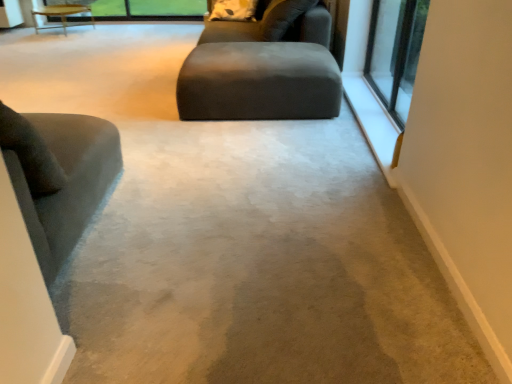
Question: From a real-world perspective, is matte gray ottoman at center over wooden table at upper left?

Choices:
 (A) no
 (B) yes

Answer: (B)

Question: Does matte gray ottoman at center come behind wooden table at upper left?

Choices:
 (A) yes
 (B) no

Answer: (B)

Question: Is matte gray ottoman at center beside wooden table at upper left?

Choices:
 (A) yes
 (B) no

Answer: (B)

Question: Considering the relative sizes of matte gray ottoman at center and wooden table at upper left in the image provided, is matte gray ottoman at center wider than wooden table at upper left?

Choices:
 (A) yes
 (B) no

Answer: (A)

Question: Are matte gray ottoman at center and wooden table at upper left located far from each other?

Choices:
 (A) no
 (B) yes

Answer: (B)

Question: Is velvet gray chair at left wider or thinner than matte gray ottoman at center?

Choices:
 (A) wide
 (B) thin

Answer: (B)

Question: Is velvet gray chair at left bigger or smaller than matte gray ottoman at center?

Choices:
 (A) big
 (B) small

Answer: (A)

Question: Is velvet gray chair at left taller or shorter than matte gray ottoman at center?

Choices:
 (A) tall
 (B) short

Answer: (A)

Question: From a real-world perspective, relative to matte gray ottoman at center, is velvet gray chair at left vertically above or below?

Choices:
 (A) above
 (B) below

Answer: (A)

Question: From the image's perspective, relative to white soft pillow at upper center, is clear glass window at upper right above or below?

Choices:
 (A) above
 (B) below

Answer: (B)

Question: In the image, is clear glass window at upper right positioned in front of or behind white soft pillow at upper center?

Choices:
 (A) front
 (B) behind

Answer: (A)

Question: From their relative heights in the image, would you say clear glass window at upper right is taller or shorter than white soft pillow at upper center?

Choices:
 (A) short
 (B) tall

Answer: (B)

Question: From a real-world perspective, is clear glass window at upper right physically located above or below white soft pillow at upper center?

Choices:
 (A) below
 (B) above

Answer: (A)

Question: Do you think matte gray ottoman at center is within clear glass window at upper right, or outside of it?

Choices:
 (A) outside
 (B) inside

Answer: (A)

Question: From the image's perspective, is matte gray ottoman at center located above or below clear glass window at upper right?

Choices:
 (A) below
 (B) above

Answer: (A)